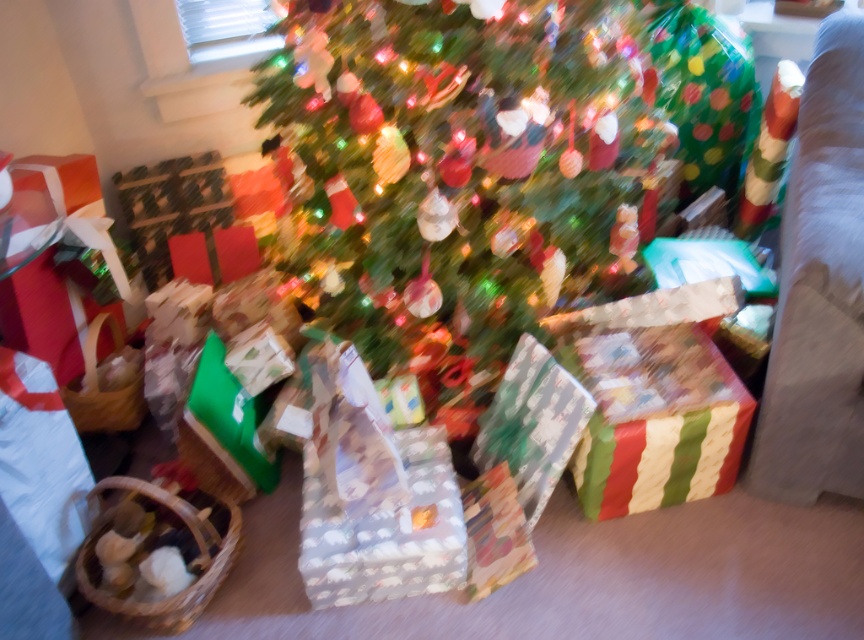
Question: From the image, what is the correct spatial relationship of shiny green tree at center in relation to white fabric armchair at right?

Choices:
 (A) left
 (B) right

Answer: (A)

Question: Which object appears farthest from the camera in this image?

Choices:
 (A) white fabric armchair at right
 (B) shiny green tree at center

Answer: (B)

Question: In this image, where is shiny green tree at center located relative to white fabric armchair at right?

Choices:
 (A) above
 (B) below

Answer: (A)

Question: Which of the following is the farthest from the observer?

Choices:
 (A) shiny green tree at center
 (B) white fabric armchair at right

Answer: (A)

Question: Which of the following is the closest to the observer?

Choices:
 (A) (856, 378)
 (B) (430, 134)

Answer: (A)

Question: Can you confirm if shiny green tree at center is smaller than white fabric armchair at right?

Choices:
 (A) yes
 (B) no

Answer: (B)